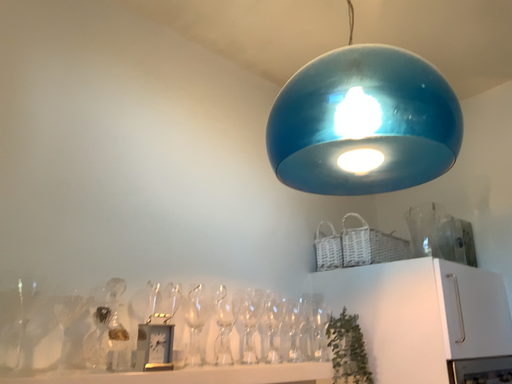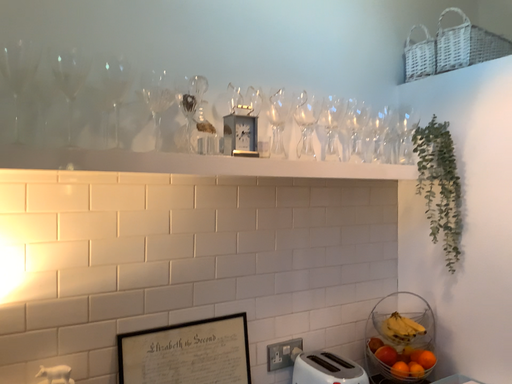
Question: Which way did the camera rotate in the video?

Choices:
 (A) rotated upward
 (B) rotated downward

Answer: (B)